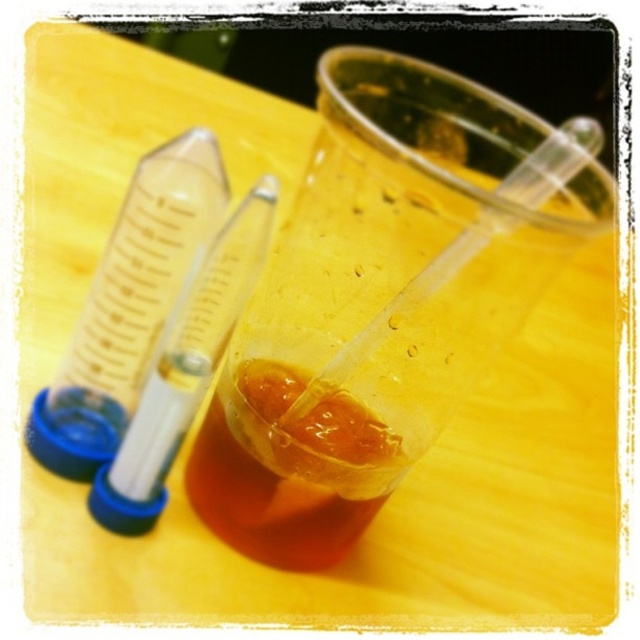
Is translucent plastic cup at center positioned in front of translucent amber liquid at center?

That is True.

Is translucent plastic cup at center shorter than translucent amber liquid at center?

In fact, translucent plastic cup at center may be taller than translucent amber liquid at center.

Which is in front, point (296, 401) or point (314, 458)?

Point (314, 458)

You are a GUI agent. You are given a task and a screenshot of the screen. Output one action in this format:
    pyautogui.click(x=<x>, y=<y>)
    Task: Click on the translucent plastic cup at center
    The width and height of the screenshot is (640, 640).
    Given the screenshot: What is the action you would take?
    pyautogui.click(x=384, y=298)

Based on the photo, is transparent plastic test tube at left above translucent amber liquid at center?

Yes.

Is transparent plastic test tube at left to the left of translucent amber liquid at center from the viewer's perspective?

Indeed, transparent plastic test tube at left is positioned on the left side of translucent amber liquid at center.

Measure the distance between point (166, 243) and camera.

Point (166, 243) is 7.71 inches from camera.

Locate an element on the screen. transparent plastic test tube at left is located at coordinates (129, 305).

Is point (401, 248) more distant than point (166, 358)?

No, it is not.

Does translucent plastic cup at center appear on the left side of transparent plastic test tube at center?

No, translucent plastic cup at center is not to the left of transparent plastic test tube at center.

This screenshot has height=640, width=640. What do you see at coordinates (384, 298) in the screenshot? I see `translucent plastic cup at center` at bounding box center [384, 298].

I want to click on translucent plastic cup at center, so click(384, 298).